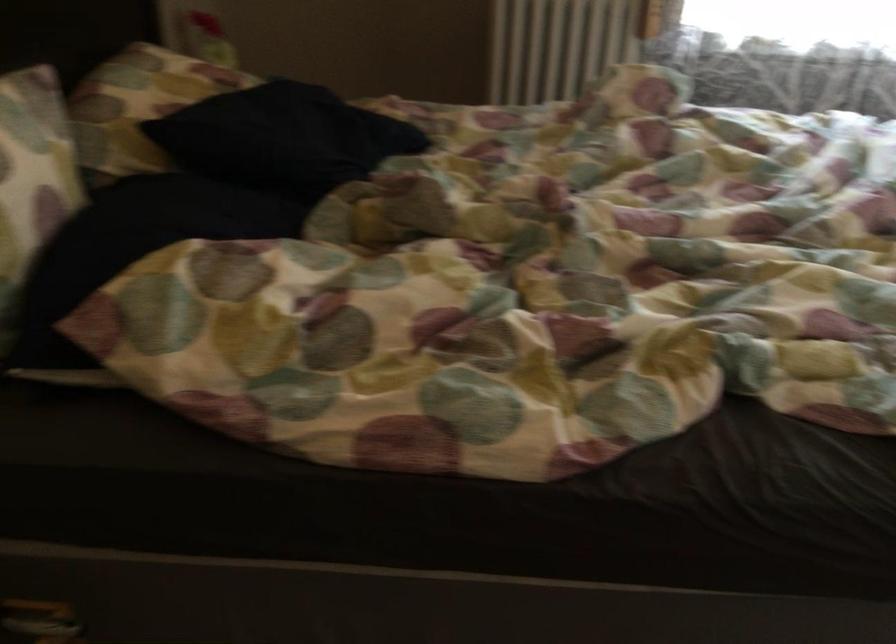
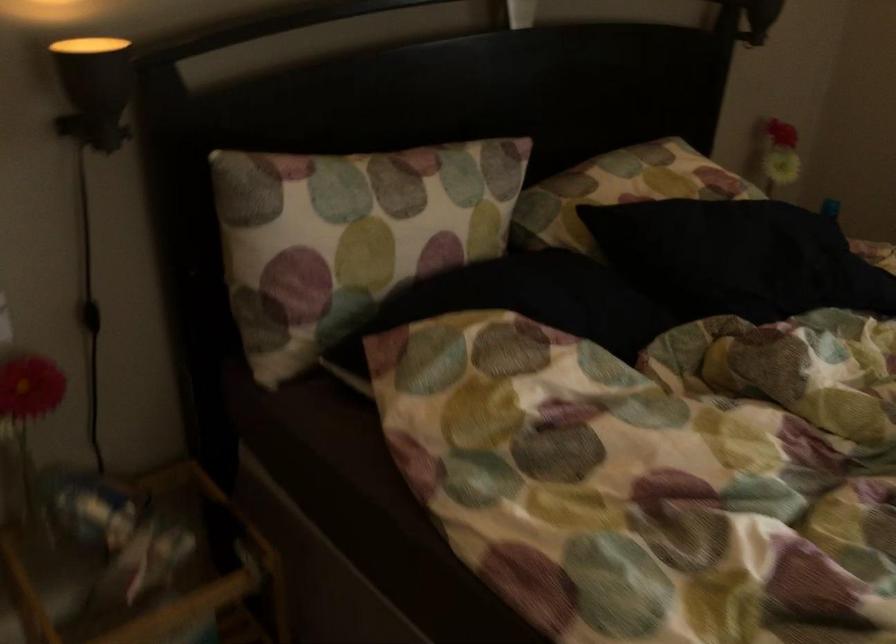
The point at (x=169, y=88) is marked in the first image. Where is the corresponding point in the second image?

(649, 176)